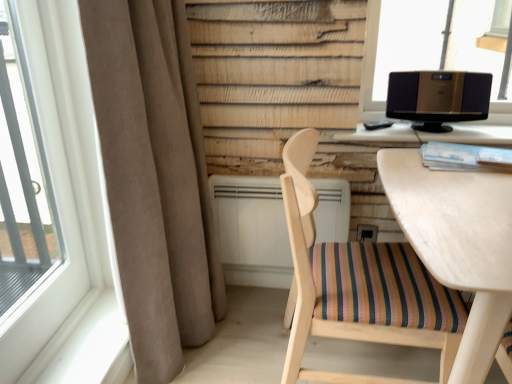
Question: From a real-world perspective, is beige fabric curtain at left physically below metallic silver speaker at upper right?

Choices:
 (A) yes
 (B) no

Answer: (A)

Question: Can metallic silver speaker at upper right be found inside beige fabric curtain at left?

Choices:
 (A) no
 (B) yes

Answer: (A)

Question: From a real-world perspective, does beige fabric curtain at left stand above metallic silver speaker at upper right?

Choices:
 (A) yes
 (B) no

Answer: (B)

Question: Does beige fabric curtain at left have a smaller size compared to metallic silver speaker at upper right?

Choices:
 (A) no
 (B) yes

Answer: (A)

Question: Is beige fabric curtain at left next to metallic silver speaker at upper right and touching it?

Choices:
 (A) yes
 (B) no

Answer: (B)

Question: Considering the positions of point (325, 266) and point (137, 286), is point (325, 266) closer or farther from the camera than point (137, 286)?

Choices:
 (A) closer
 (B) farther

Answer: (B)

Question: Based on their positions, is wooden chair with striped cushion at center located to the left or right of beige fabric curtain at left?

Choices:
 (A) right
 (B) left

Answer: (A)

Question: From their relative heights in the image, would you say wooden chair with striped cushion at center is taller or shorter than beige fabric curtain at left?

Choices:
 (A) tall
 (B) short

Answer: (B)

Question: Is wooden chair with striped cushion at center inside or outside of beige fabric curtain at left?

Choices:
 (A) inside
 (B) outside

Answer: (B)

Question: Visually, is transparent glass window at upper right, marked as the second window in a left-to-right arrangement, positioned to the left or to the right of metallic silver speaker at upper right?

Choices:
 (A) right
 (B) left

Answer: (A)

Question: In terms of height, does transparent glass window at upper right, acting as the first window starting from the right, look taller or shorter compared to metallic silver speaker at upper right?

Choices:
 (A) tall
 (B) short

Answer: (A)

Question: Is point (422, 66) positioned closer to the camera than point (424, 122)?

Choices:
 (A) farther
 (B) closer

Answer: (A)

Question: Is transparent glass window at upper right, marked as the 2th window in a front-to-back arrangement, spatially inside metallic silver speaker at upper right, or outside of it?

Choices:
 (A) inside
 (B) outside

Answer: (B)

Question: Choose the correct answer: Is transparent glass window at upper right, which is the 1th window from back to front, inside white plastic air conditioner at center or outside it?

Choices:
 (A) inside
 (B) outside

Answer: (B)

Question: From the image's perspective, is transparent glass window at upper right, marked as the second window in a left-to-right arrangement, above or below white plastic air conditioner at center?

Choices:
 (A) above
 (B) below

Answer: (A)